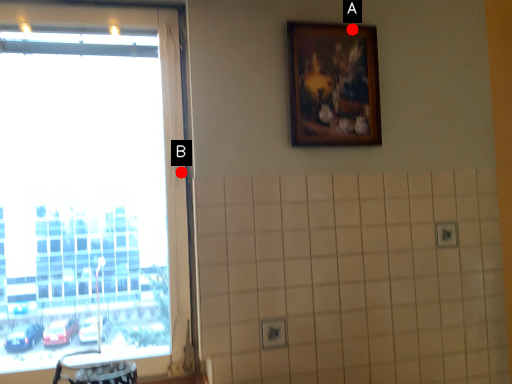
Question: Two points are circled on the image, labeled by A and B beside each circle. Which point is further to the camera?

Choices:
 (A) A is further
 (B) B is further

Answer: (A)